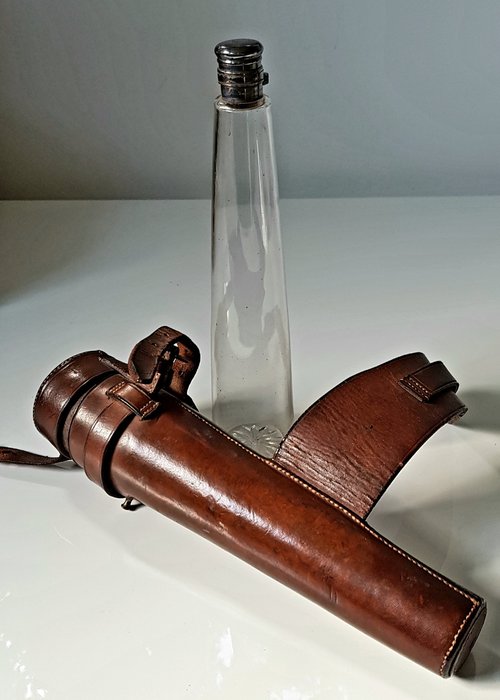
At what (x,y) coordinates should I click in order to perform the action: click on glass jar. Please return your answer as a coordinate pair (x, y). This screenshot has width=500, height=700. Looking at the image, I should click on (276, 385).